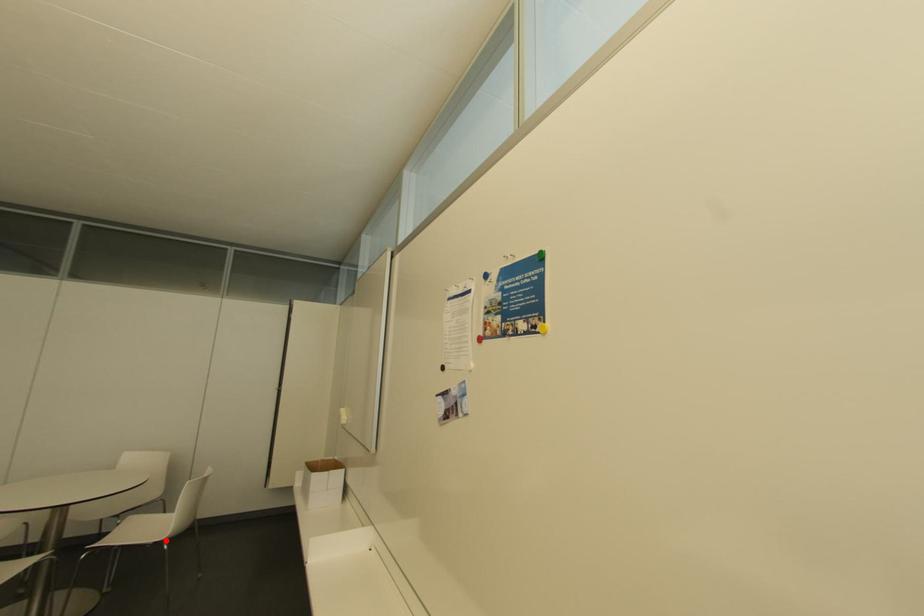
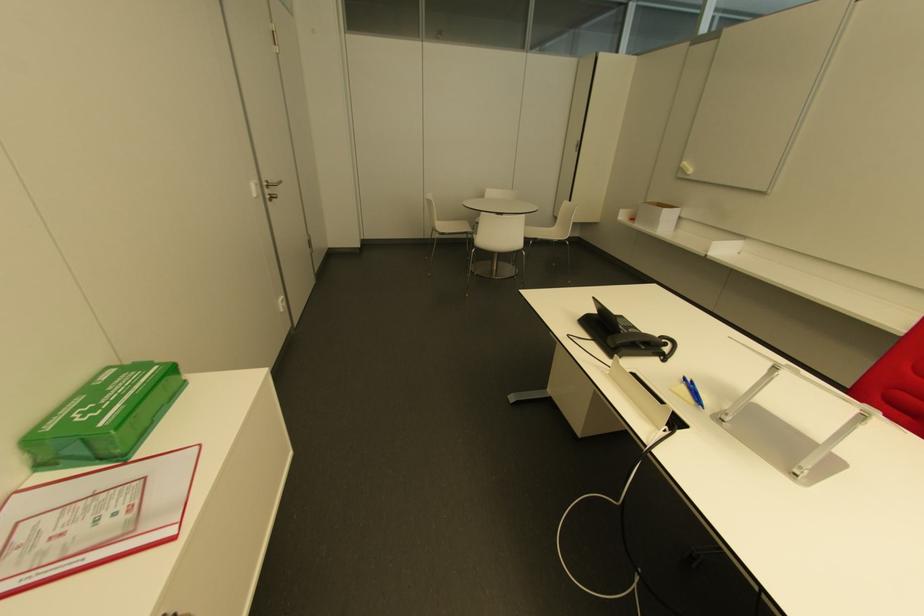
Find the pixel in the second image that matches the highlighted location in the first image.

(565, 240)